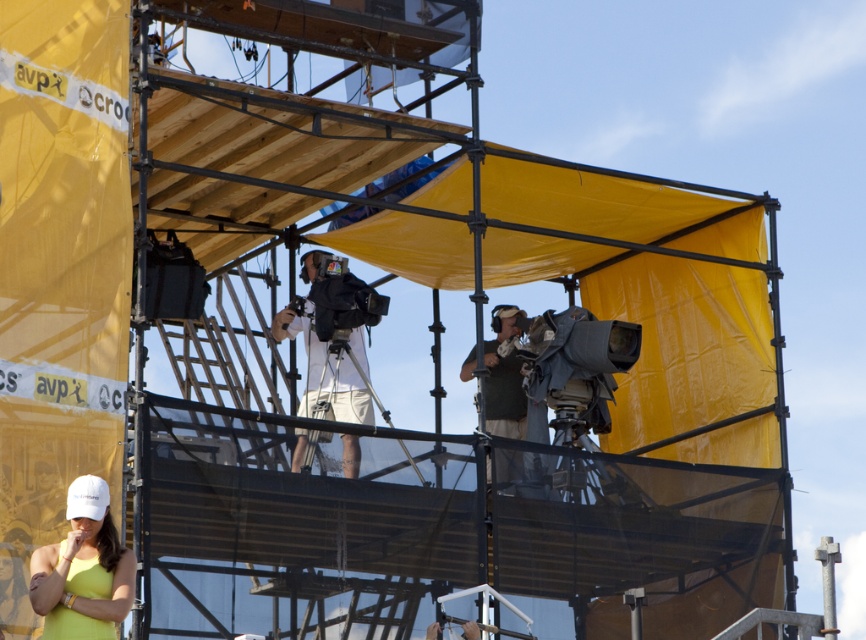
You are a technician checking equipment heights for safety. You see the white matte baseball cap at lower left and the white matte camera at center. Which object is shorter?

The white matte baseball cap at lower left is not as tall as the white matte camera at center, so the white matte baseball cap at lower left is shorter.

You are a stagehand at an event and need to place a 1.2 meter tall equipment box between the white matte baseball cap at lower left and the green fabric vest at center. Can the box fit vertically between them?

The white matte baseball cap at lower left is shorter than the green fabric vest at center, so the vertical space between them may be sufficient. However, without knowing the exact height difference, it is uncertain if the 1.2 meter tall equipment box will fit vertically between them.